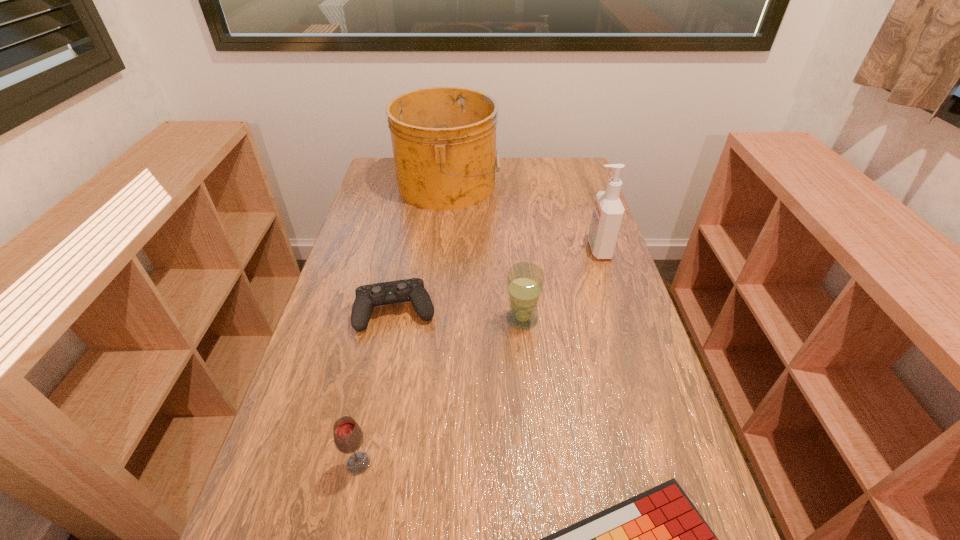
This screenshot has height=540, width=960. What are the coordinates of `the farthest object` in the screenshot? It's located at (444, 138).

The height and width of the screenshot is (540, 960). What are the coordinates of `the second farthest object` in the screenshot? It's located at tap(608, 212).

The width and height of the screenshot is (960, 540). I want to click on the right glass drink container, so click(525, 281).

The width and height of the screenshot is (960, 540). Find the location of `the fifth farthest object`. the fifth farthest object is located at coordinates (348, 437).

Locate an element on the screen. Image resolution: width=960 pixels, height=540 pixels. the nearer glass drink container is located at coordinates (348, 437).

Locate an element on the screen. The width and height of the screenshot is (960, 540). the second shortest object is located at coordinates (367, 296).

I want to click on free space located on the front of the bucket, so click(x=438, y=286).

Find the location of a particular element. The height and width of the screenshot is (540, 960). free space located on the front label of the cleansing agent is located at coordinates (498, 249).

At what (x,y) coordinates should I click in order to perform the action: click on free point located 0.370m on the front label of the cleansing agent. Please return your answer as a coordinate pair (x, y). The width and height of the screenshot is (960, 540). Looking at the image, I should click on (469, 249).

You are a GUI agent. You are given a task and a screenshot of the screen. Output one action in this format:
    pyautogui.click(x=<x>, y=<y>)
    Task: Click on the vacant space located on the front label of the cleansing agent
    Image resolution: width=960 pixels, height=540 pixels.
    Given the screenshot: What is the action you would take?
    pyautogui.click(x=469, y=249)